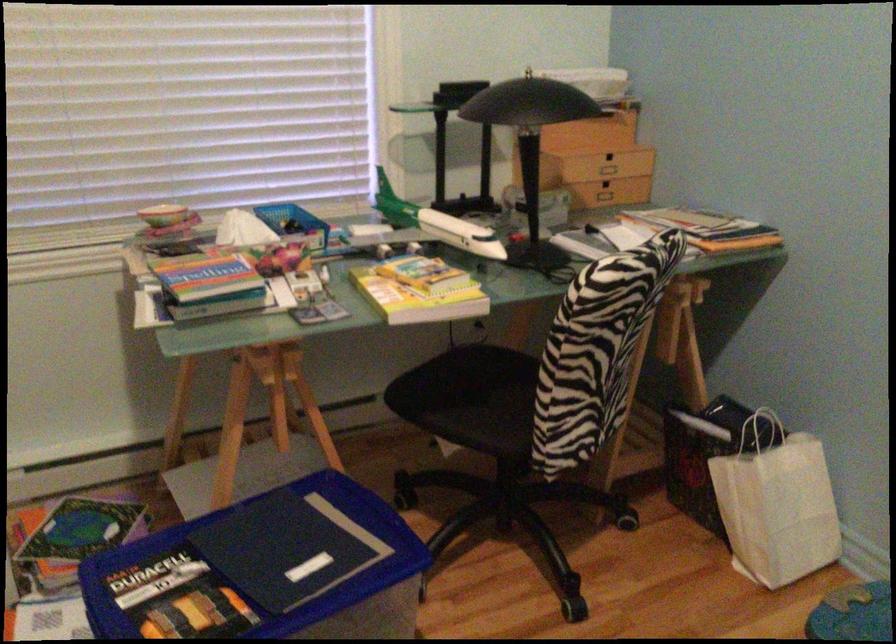
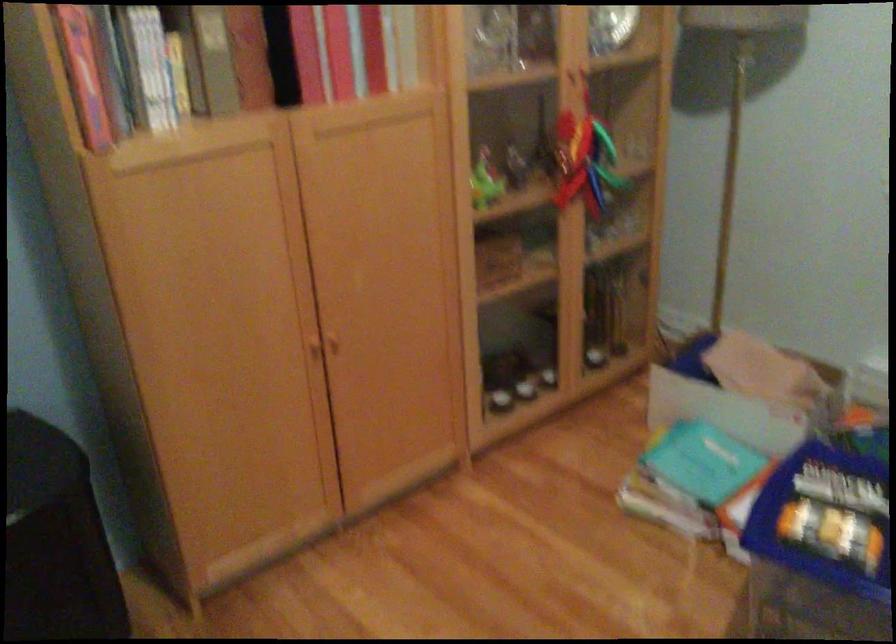
Consider the image. Based on the continuous images, in which direction is the camera rotating?

The rotation direction of the camera is left-down.